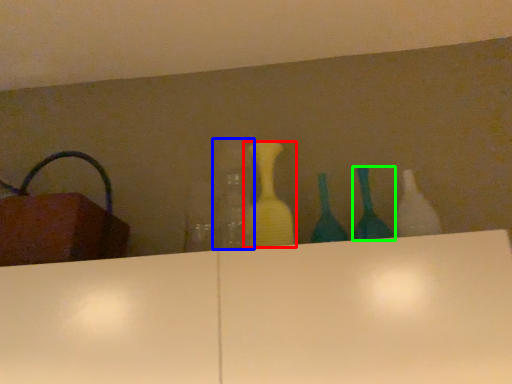
Question: Which is farther away from bottle (highlighted by a red box)? bottle (highlighted by a blue box) or bottle (highlighted by a green box)?

Choices:
 (A) bottle
 (B) bottle

Answer: (B)